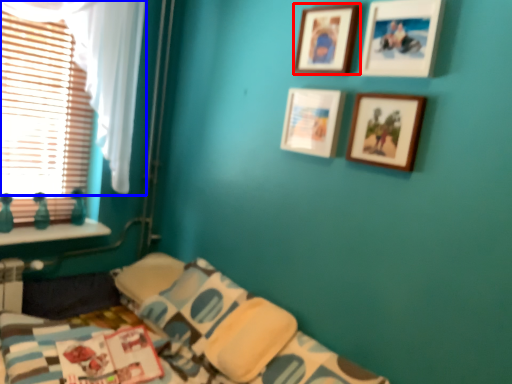
Question: Which point is further to the camera, picture frame (highlighted by a red box) or curtain (highlighted by a blue box)?

Choices:
 (A) picture frame
 (B) curtain

Answer: (B)